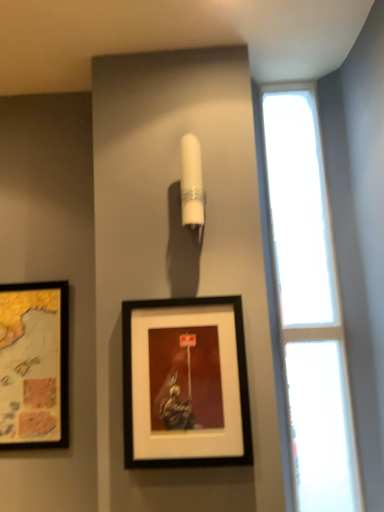
Question: In terms of width, does transparent glass window at right look wider or thinner when compared to matte black picture frame at left, which is the second picture frame from right to left?

Choices:
 (A) wide
 (B) thin

Answer: (A)

Question: From a real-world perspective, is transparent glass window at right above or below matte black picture frame at left, positioned as the second picture frame in front-to-back order?

Choices:
 (A) below
 (B) above

Answer: (B)

Question: Based on their relative distances, which object is farther from the matte black picture frame at left, which is the second picture frame from right to left?

Choices:
 (A) black matte picture frame at center, which appears as the second picture frame when viewed from the back
 (B) transparent glass window at right

Answer: (B)

Question: Which is nearer to the matte black picture frame at left, which is counted as the 1th picture frame, starting from the left?

Choices:
 (A) black matte picture frame at center, the 1th picture frame when ordered from right to left
 (B) transparent glass window at right

Answer: (A)